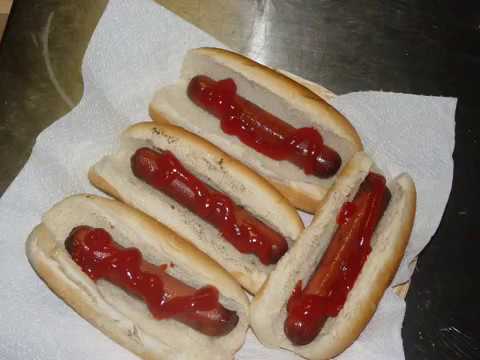
Locate an element on the screen. The image size is (480, 360). table is located at coordinates coord(248,37).